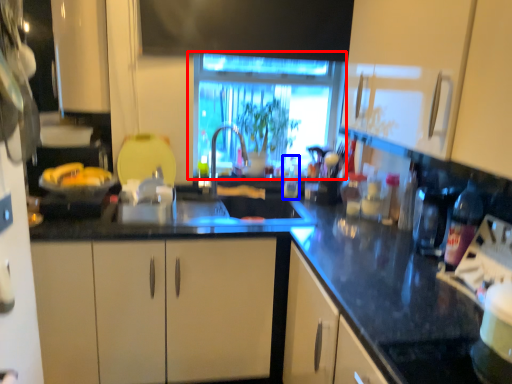
Question: Which object appears farthest to the camera in this image, window (highlighted by a red box) or bottle (highlighted by a blue box)?

Choices:
 (A) window
 (B) bottle

Answer: (B)